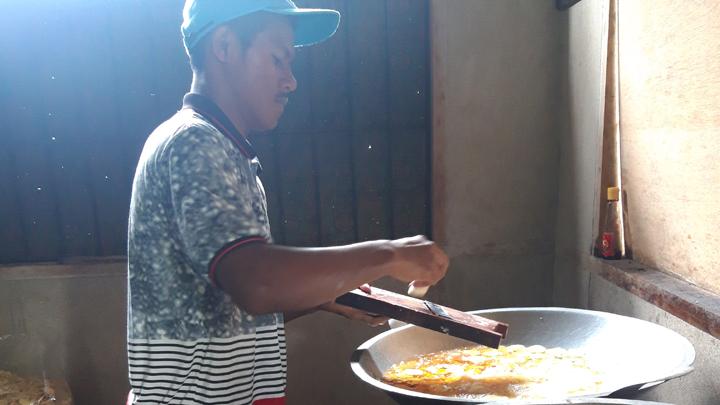
I want to click on bottle, so click(x=613, y=192), click(x=613, y=217), click(x=608, y=251).